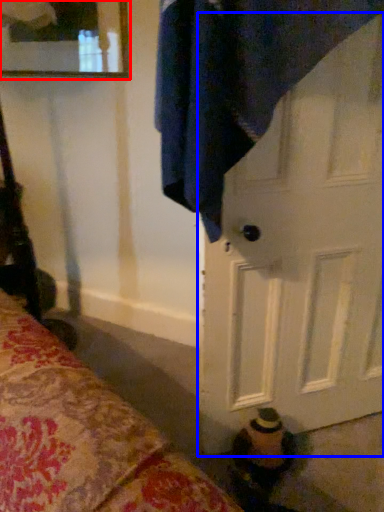
Question: Which object is further to the camera taking this photo, mirror (highlighted by a red box) or door (highlighted by a blue box)?

Choices:
 (A) mirror
 (B) door

Answer: (A)